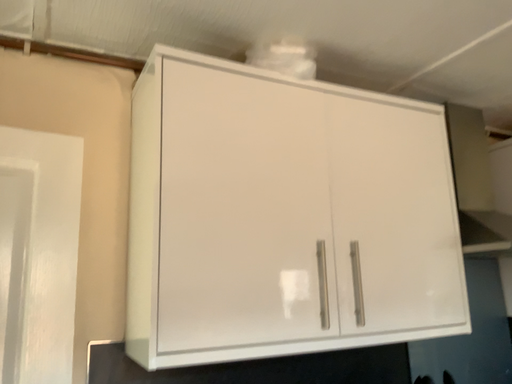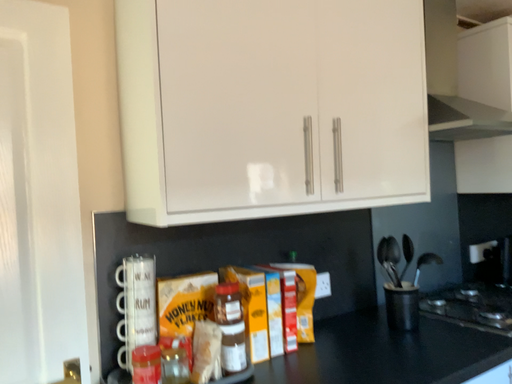
Question: How did the camera likely rotate when shooting the video?

Choices:
 (A) rotated downward
 (B) rotated upward

Answer: (A)